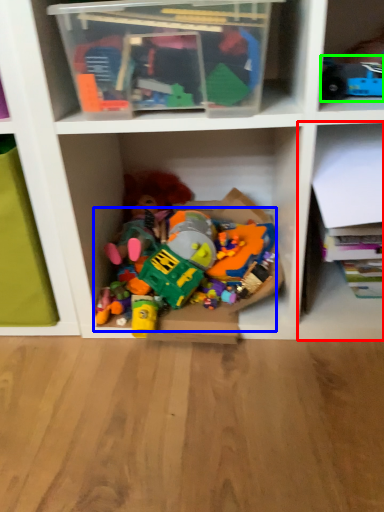
Question: Which object is positioned farthest from shelf (highlighted by a red box)? Select from toy (highlighted by a blue box) and toy (highlighted by a green box).

Choices:
 (A) toy
 (B) toy

Answer: (B)